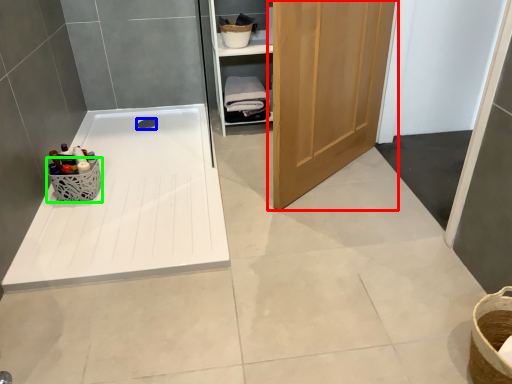
Question: Which is nearer to the door (highlighted by a red box)? drain (highlighted by a blue box) or basket (highlighted by a green box).

Choices:
 (A) drain
 (B) basket

Answer: (B)